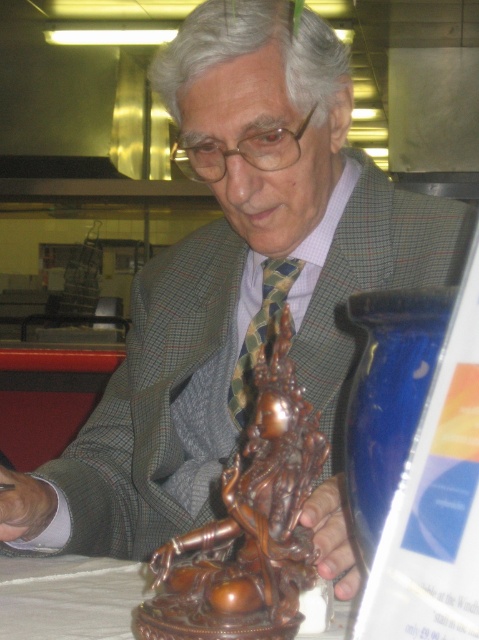
You are a photographer trying to capture the bronze statue at center and the green checkered tie at center in a single shot. Which object will appear larger in the photo?

The bronze statue at center will appear larger in the photo because it is closer to the viewer than the green checkered tie at center.

Looking at this image, you are a photographer trying to capture the bronze statue at center and the green checkered tie at center in a single frame. Based on their sizes, which object would appear more prominent in the photo?

The bronze statue at center appears more prominent in the photo because it has a larger size compared to the green checkered tie at center.